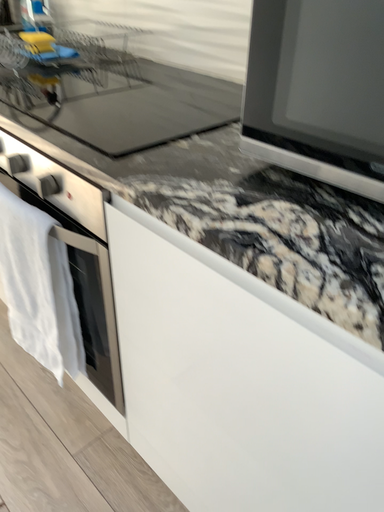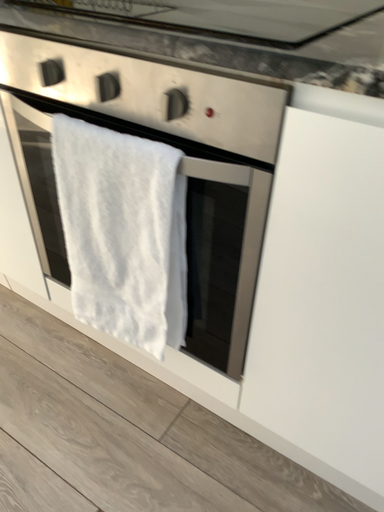
Question: How did the camera likely rotate when shooting the video?

Choices:
 (A) rotated right
 (B) rotated left

Answer: (A)